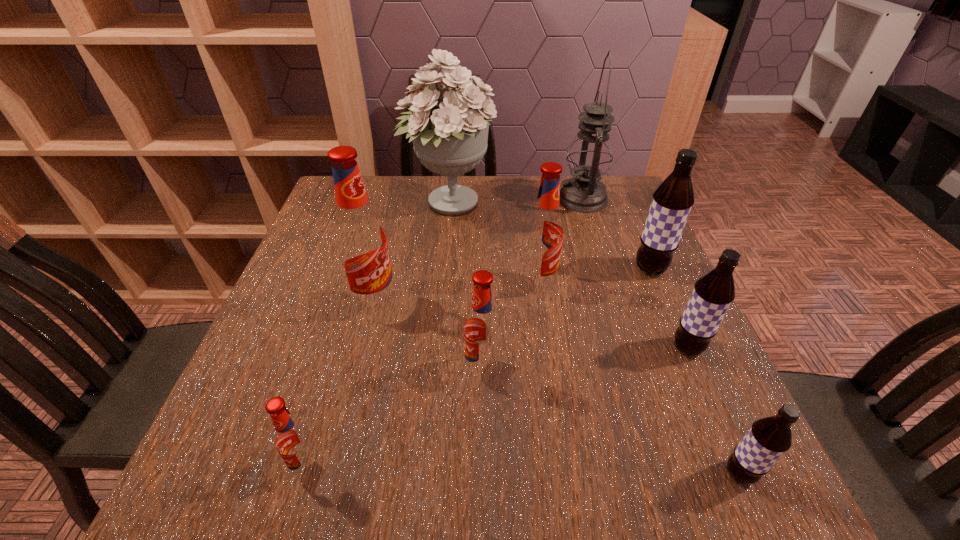
At what (x,y) coordinates should I click in order to perform the action: click on the nearest brown root beer. Please return your answer as a coordinate pair (x, y). The height and width of the screenshot is (540, 960). Looking at the image, I should click on tap(769, 438).

I want to click on vacant space situated on the front of the gray oil lamp, so coord(605,269).

The width and height of the screenshot is (960, 540). Find the location of `vacant space located on the front of the green bouquet`. vacant space located on the front of the green bouquet is located at coordinates (440, 309).

Find the location of `blank area located on the left of the tallest root beer`. blank area located on the left of the tallest root beer is located at coordinates (321, 302).

The width and height of the screenshot is (960, 540). Identify the location of vacant region located 0.290m on the front of the third smallest red root beer. [557, 413].

Find the location of a particular element. vacant point located 0.320m on the back of the biggest brown root beer is located at coordinates (615, 190).

Where is `vacant space located 0.070m on the right of the third biggest red root beer`? The width and height of the screenshot is (960, 540). vacant space located 0.070m on the right of the third biggest red root beer is located at coordinates (537, 370).

Where is `free region located 0.180m on the front of the second nearest brown root beer`? This screenshot has height=540, width=960. free region located 0.180m on the front of the second nearest brown root beer is located at coordinates (733, 451).

Locate an element on the screen. The width and height of the screenshot is (960, 540). free space located on the back of the smallest red root beer is located at coordinates (328, 399).

The height and width of the screenshot is (540, 960). In order to click on vacant space located 0.100m on the back of the nearest brown root beer in this screenshot , I will do `click(708, 403)`.